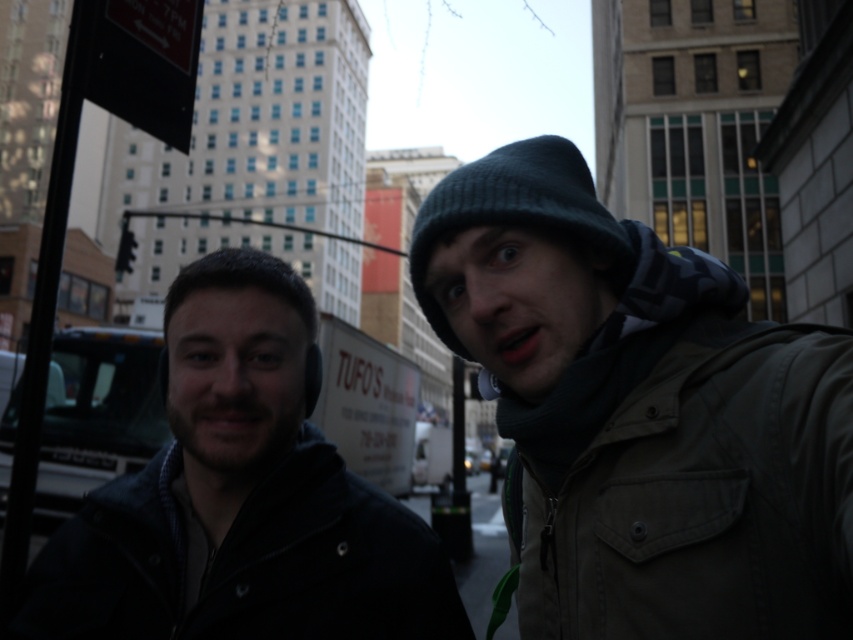
Does dark blue jacket at center have a lesser width compared to black knit hat at upper right?

Incorrect, dark blue jacket at center's width is not less than black knit hat at upper right's.

What do you see at coordinates (241, 497) in the screenshot? I see `dark blue jacket at center` at bounding box center [241, 497].

Is point (422, 573) in front of point (601, 243)?

No, it is not.

This screenshot has height=640, width=853. I want to click on dark blue jacket at center, so (241, 497).

Between knit cap at upper right and black knit hat at upper right, which one is positioned lower?

knit cap at upper right

Who is taller, knit cap at upper right or black knit hat at upper right?

knit cap at upper right

Which is behind, point (538, 538) or point (527, 214)?

Positioned behind is point (538, 538).

You are a GUI agent. You are given a task and a screenshot of the screen. Output one action in this format:
    pyautogui.click(x=<x>, y=<y>)
    Task: Click on the knit cap at upper right
    This screenshot has height=640, width=853.
    Given the screenshot: What is the action you would take?
    pyautogui.click(x=642, y=413)

Is knit cap at upper right positioned behind dark blue jacket at center?

No, it is in front of dark blue jacket at center.

Is knit cap at upper right to the left of dark blue jacket at center from the viewer's perspective?

No, knit cap at upper right is not to the left of dark blue jacket at center.

Between point (461, 204) and point (42, 609), which one is positioned behind?

The point (42, 609) is behind.

At what (x,y) coordinates should I click in order to perform the action: click on knit cap at upper right. Please return your answer as a coordinate pair (x, y). Image resolution: width=853 pixels, height=640 pixels. Looking at the image, I should click on (642, 413).